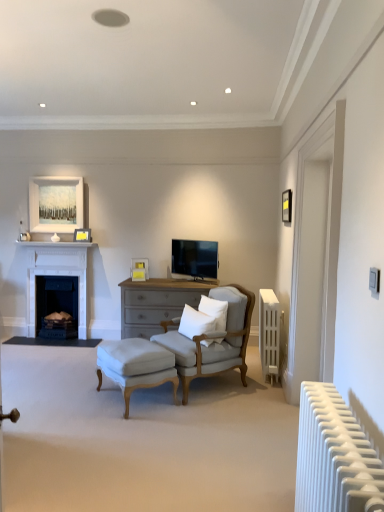
Question: In which direction should I rotate to look at matte white picture frame at center, the 2th picture frame when ordered from left to right?

Choices:
 (A) right
 (B) left

Answer: (B)

Question: From the image's perspective, is white cotton pillow at center, the first pillow viewed from the left, beneath white soft pillow at center, the first pillow positioned from the right?

Choices:
 (A) no
 (B) yes

Answer: (B)

Question: Is white soft pillow at center, the first pillow positioned from the right, located within white cotton pillow at center, the 2th pillow in the right-to-left sequence?

Choices:
 (A) yes
 (B) no

Answer: (B)

Question: Considering the relative sizes of white cotton pillow at center, the first pillow viewed from the left, and white soft pillow at center, the first pillow positioned from the right, in the image provided, is white cotton pillow at center, the first pillow viewed from the left, smaller than white soft pillow at center, the first pillow positioned from the right,?

Choices:
 (A) no
 (B) yes

Answer: (B)

Question: Can you confirm if white cotton pillow at center, the first pillow viewed from the left, is positioned to the left of white soft pillow at center, the second pillow when ordered from left to right?

Choices:
 (A) yes
 (B) no

Answer: (A)

Question: From the image's perspective, is white cotton pillow at center, the 2th pillow in the right-to-left sequence, over white soft pillow at center, the second pillow when ordered from left to right?

Choices:
 (A) yes
 (B) no

Answer: (B)

Question: Does white cotton pillow at center, the 2th pillow in the right-to-left sequence, have a lesser height compared to white soft pillow at center, the second pillow when ordered from left to right?

Choices:
 (A) no
 (B) yes

Answer: (B)

Question: Can you confirm if white matte radiator at right, the 2th radiator from the back, is shorter than matte white picture frame at center, the 2th picture frame when ordered from left to right?

Choices:
 (A) no
 (B) yes

Answer: (A)

Question: Is white matte radiator at right, the second radiator in the right-to-left sequence, closer to the viewer compared to matte white picture frame at center, the first picture frame from the bottom?

Choices:
 (A) yes
 (B) no

Answer: (A)

Question: From a real-world perspective, is white matte radiator at right, placed as the 1th radiator when sorted from left to right, positioned under matte white picture frame at center, the 3th picture frame positioned from the top, based on gravity?

Choices:
 (A) yes
 (B) no

Answer: (A)

Question: Is white matte radiator at right, the 2th radiator from the back, smaller than matte white picture frame at center, the first picture frame from the bottom?

Choices:
 (A) no
 (B) yes

Answer: (A)

Question: Is white matte radiator at right, the second radiator in the right-to-left sequence, at the right side of matte white picture frame at center, the second picture frame when ordered from right to left?

Choices:
 (A) yes
 (B) no

Answer: (A)

Question: Can you confirm if white matte radiator at right, the second radiator in the right-to-left sequence, is taller than matte white picture frame at center, the 3th picture frame positioned from the top?

Choices:
 (A) no
 (B) yes

Answer: (B)

Question: Is white soft pillow at center, the first pillow positioned from the right, bigger than matte black picture frame at upper right, the third picture frame positioned from the bottom?

Choices:
 (A) yes
 (B) no

Answer: (A)